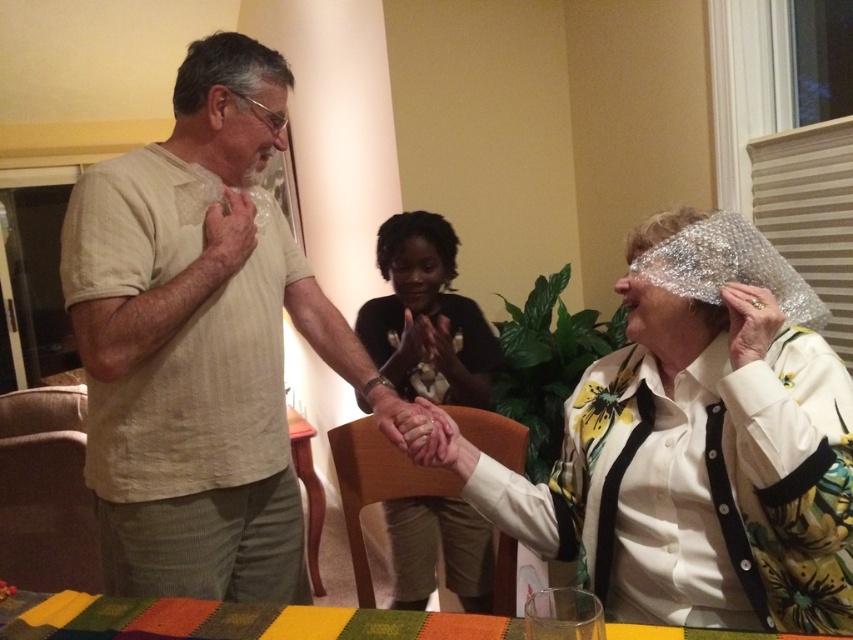
Question: Is beige textured shirt at center smaller than multicolored woven cloth at lower center?

Choices:
 (A) yes
 (B) no

Answer: (B)

Question: Which is nearer to the shiny metallic foil at center?

Choices:
 (A) matte black shirt at center
 (B) multicolored woven cloth at lower center
 (C) beige textured shirt at center

Answer: (B)

Question: Which object is closer to the camera taking this photo?

Choices:
 (A) multicolored woven cloth at lower center
 (B) beige textured shirt at center
 (C) shiny metallic foil at center

Answer: (A)

Question: Considering the relative positions of shiny metallic foil at center and multicolored woven cloth at lower center in the image provided, where is shiny metallic foil at center located with respect to multicolored woven cloth at lower center?

Choices:
 (A) below
 (B) above

Answer: (B)

Question: Is beige textured shirt at center behind shiny metallic foil at center?

Choices:
 (A) yes
 (B) no

Answer: (A)

Question: Estimate the real-world distances between objects in this image. Which object is closer to the matte black shirt at center?

Choices:
 (A) beige textured shirt at center
 (B) shiny metallic foil at center

Answer: (A)